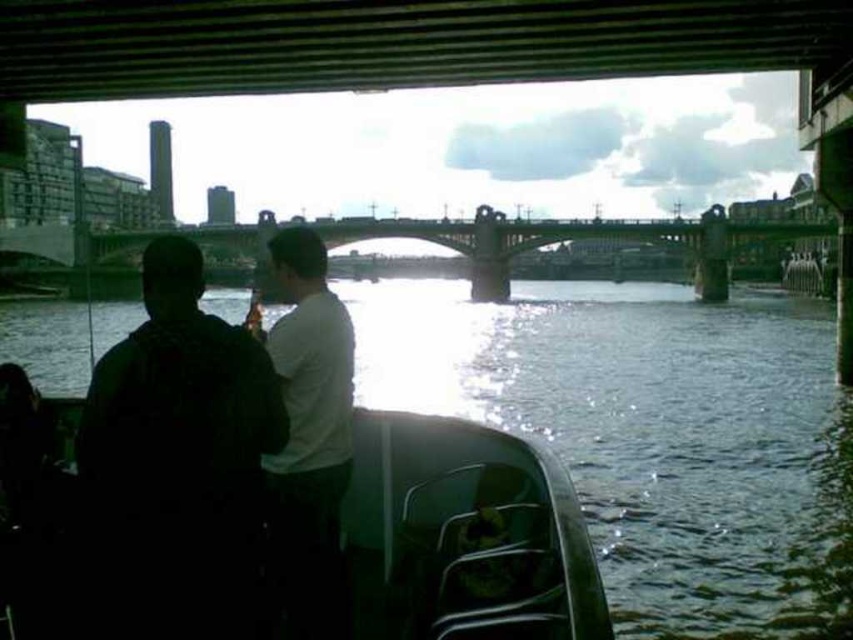
You are an observer standing on the boat and looking towards the concrete bridge at center. Can you see the greenish water at lower center from your current position?

Yes, because the greenish water at lower center is positioned under the concrete bridge at center, so it should be visible from the boat.

You are a photographer planning to capture the entire bridge and the water in one shot. Based on the scene, will the greenish water at lower center and the concrete bridge at center fit within the frame if the bridge is wider than the water?

The greenish water at lower center has a lesser width compared to the concrete bridge at center, so the bridge is wider. Since the photographer wants to capture the entire bridge and the water, the frame must accommodate the wider bridge. Therefore, both the greenish water at lower center and the concrete bridge at center will fit within the frame as the bridge is the wider element and the water is narrower.

You are standing on the boat and want to move from the dark fabric shirt at left to the greenish water at lower center. Which direction should you move towards?

You should move towards the right direction because the greenish water at lower center is to the right of the dark fabric shirt at left.